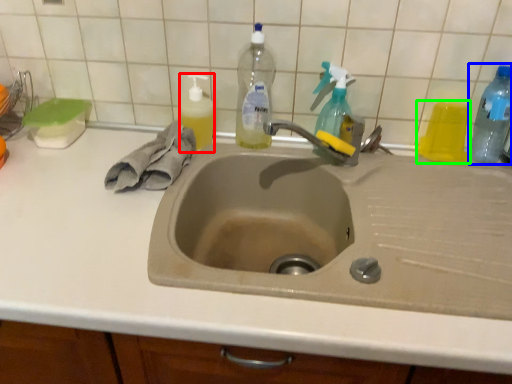
Question: Based on their relative distances, which object is farther from cleaning product (highlighted by a red box)? Choose from bottle (highlighted by a blue box) and bottle (highlighted by a green box).

Choices:
 (A) bottle
 (B) bottle

Answer: (A)